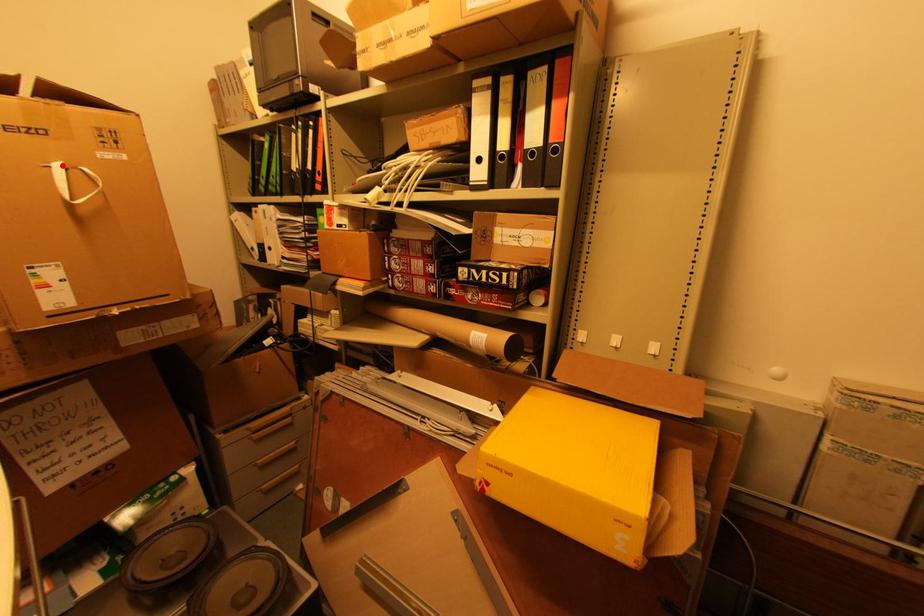
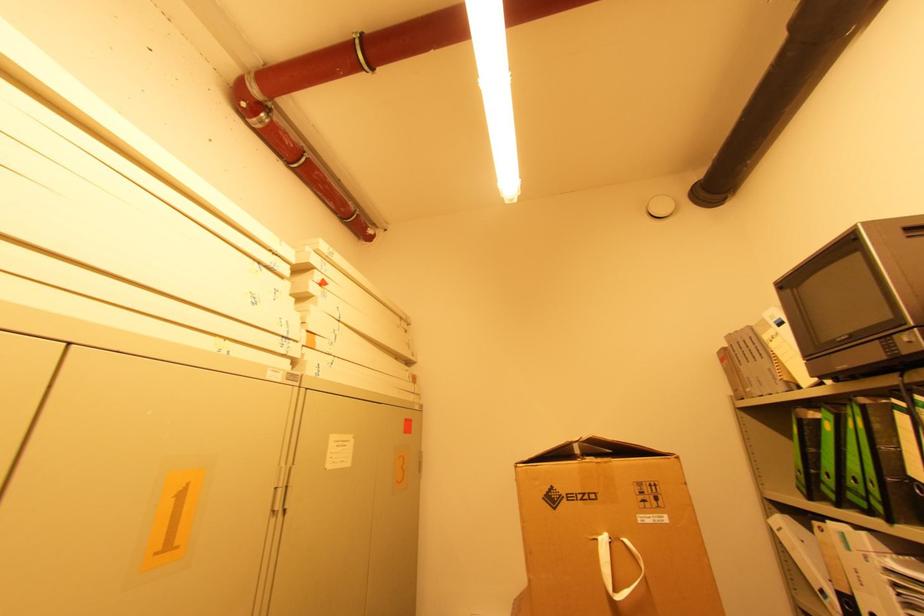
Locate, in the second image, the point that corresponds to the highlighted location in the first image.

(608, 541)